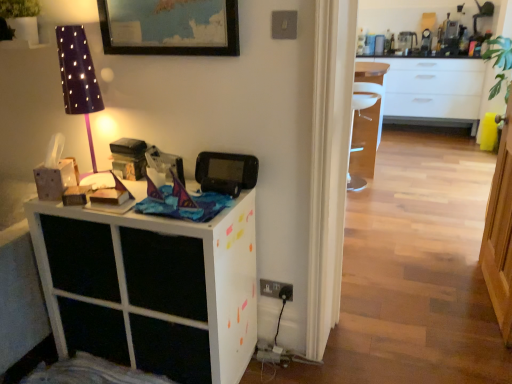
Question: Based on their sizes in the image, would you say purple dotted fabric lampshade at upper left is bigger or smaller than white matte cabinet at left?

Choices:
 (A) big
 (B) small

Answer: (B)

Question: Is purple dotted fabric lampshade at upper left inside the boundaries of white matte cabinet at left, or outside?

Choices:
 (A) outside
 (B) inside

Answer: (A)

Question: Which object is the farthest from the white matte cabinet at left?

Choices:
 (A) purple dotted fabric lampshade at upper left
 (B) black plastic game console at upper center

Answer: (A)

Question: Which of these objects is positioned farthest from the white matte cabinet at left?

Choices:
 (A) purple dotted fabric lampshade at upper left
 (B) black plastic game console at upper center

Answer: (A)